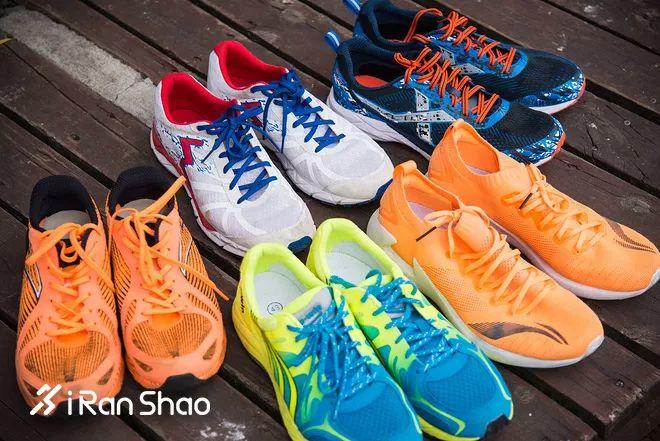
Locate an element on the screen. shoe is located at coordinates (88, 360), (170, 330), (255, 194), (311, 164), (410, 126), (472, 79), (552, 218), (513, 272), (422, 344), (354, 395).